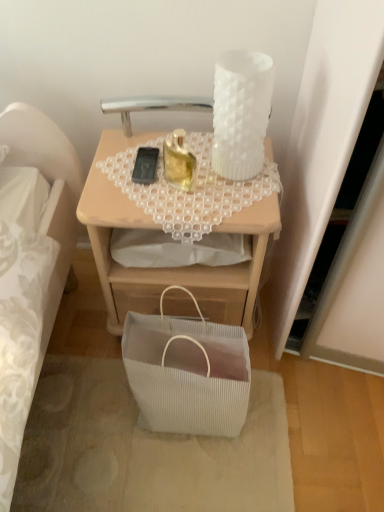
Question: Is white ribbed fabric bag at lower center shorter than black matte mobile phone at center?

Choices:
 (A) yes
 (B) no

Answer: (B)

Question: From the image's perspective, is white ribbed fabric bag at lower center located above black matte mobile phone at center?

Choices:
 (A) no
 (B) yes

Answer: (A)

Question: Are white ribbed fabric bag at lower center and black matte mobile phone at center making contact?

Choices:
 (A) no
 (B) yes

Answer: (A)

Question: Is white ribbed fabric bag at lower center wider than black matte mobile phone at center?

Choices:
 (A) no
 (B) yes

Answer: (B)

Question: Does white ribbed fabric bag at lower center have a smaller size compared to black matte mobile phone at center?

Choices:
 (A) yes
 (B) no

Answer: (B)

Question: Is black matte mobile phone at center at the back of white ribbed fabric bag at lower center?

Choices:
 (A) no
 (B) yes

Answer: (A)

Question: Does black matte mobile phone at center have a lesser height compared to white frosted glass candle holder at upper right, the 2th candle holder from the left?

Choices:
 (A) yes
 (B) no

Answer: (A)

Question: Can we say black matte mobile phone at center lies outside white frosted glass candle holder at upper right, which appears as the 1th candle holder when viewed from the right?

Choices:
 (A) no
 (B) yes

Answer: (B)

Question: From the image's perspective, does black matte mobile phone at center appear higher than white frosted glass candle holder at upper right, the 2th candle holder from the left?

Choices:
 (A) no
 (B) yes

Answer: (A)

Question: From the image's perspective, would you say black matte mobile phone at center is shown under white frosted glass candle holder at upper right, which appears as the 1th candle holder when viewed from the right?

Choices:
 (A) yes
 (B) no

Answer: (A)

Question: Is black matte mobile phone at center in front of white frosted glass candle holder at upper right, which appears as the 1th candle holder when viewed from the right?

Choices:
 (A) yes
 (B) no

Answer: (B)

Question: Can you confirm if black matte mobile phone at center is bigger than white frosted glass candle holder at upper right, the 2th candle holder from the left?

Choices:
 (A) yes
 (B) no

Answer: (B)

Question: Can you confirm if white frosted glass candle holder at upper right, which appears as the 1th candle holder when viewed from the right, is positioned to the left of translucent glass candle at upper center, arranged as the second candle holder when viewed from the right?

Choices:
 (A) no
 (B) yes

Answer: (A)